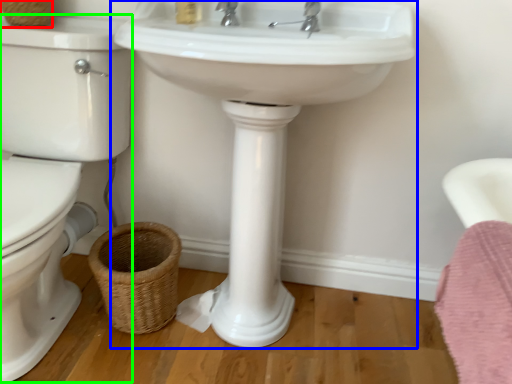
Question: Which object is positioned farthest from basket (highlighted by a red box)? Select from sink (highlighted by a blue box) and toilet bowl (highlighted by a green box).

Choices:
 (A) sink
 (B) toilet bowl

Answer: (A)